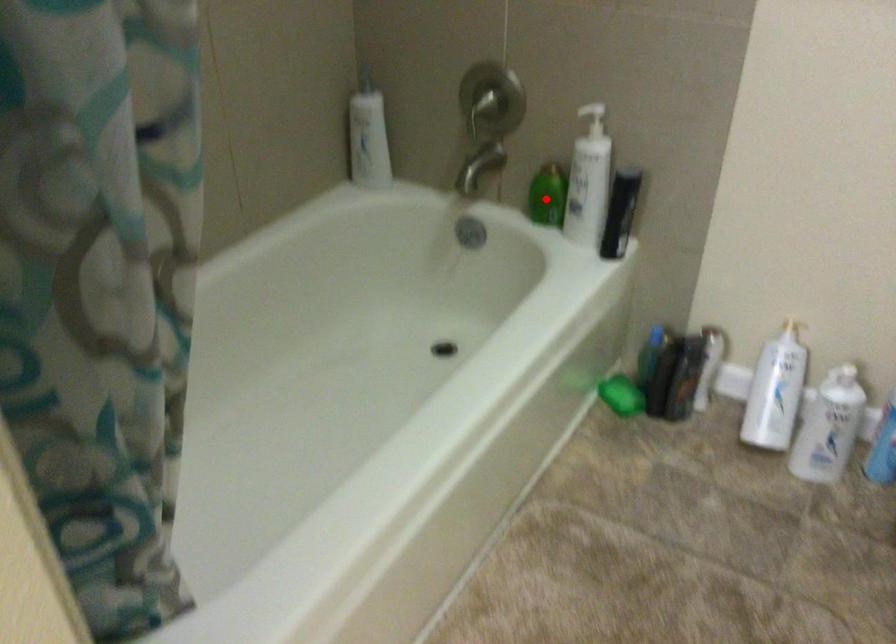
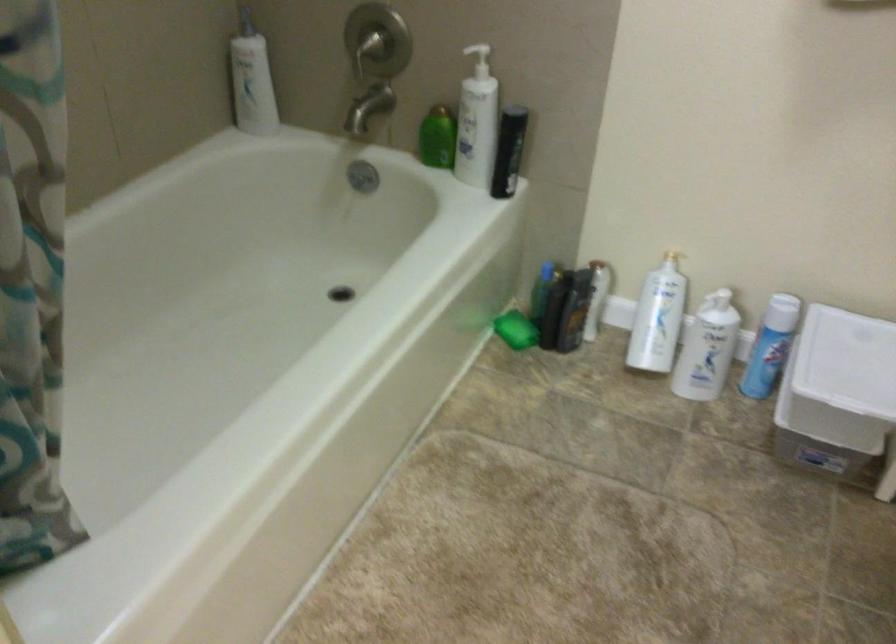
Find the pixel in the second image that matches the highlighted location in the first image.

(437, 138)